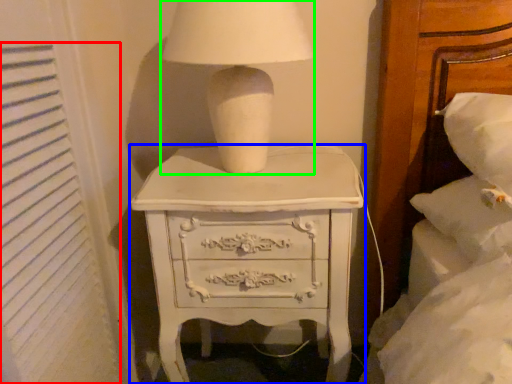
Question: Estimate the real-world distances between objects in this image. Which object is farther from curtain (highlighted by a red box), chest of drawers (highlighted by a blue box) or table lamp (highlighted by a green box)?

Choices:
 (A) chest of drawers
 (B) table lamp

Answer: (B)